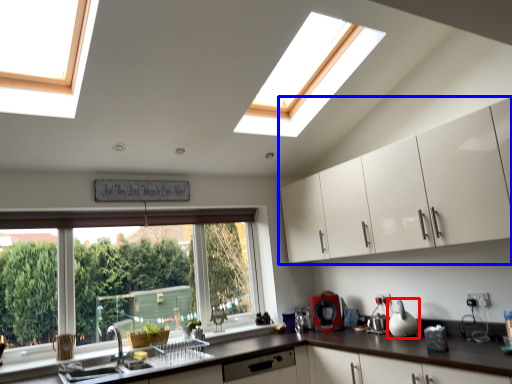
Question: Which object appears closest to the camera in this image, appliance (highlighted by a red box) or cabinetry (highlighted by a blue box)?

Choices:
 (A) appliance
 (B) cabinetry

Answer: (B)